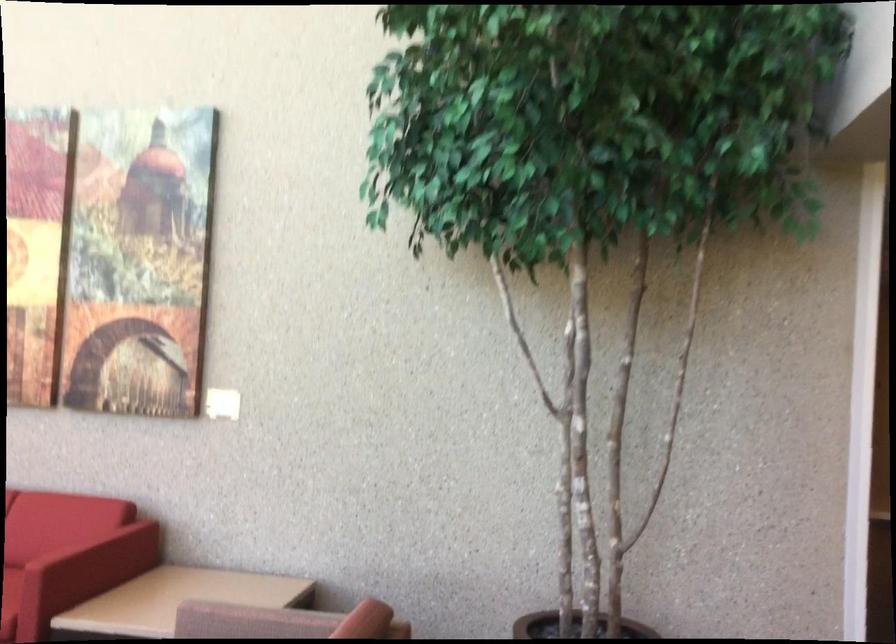
Describe the element at coordinates (80, 540) in the screenshot. I see `the red sofa armrest` at that location.